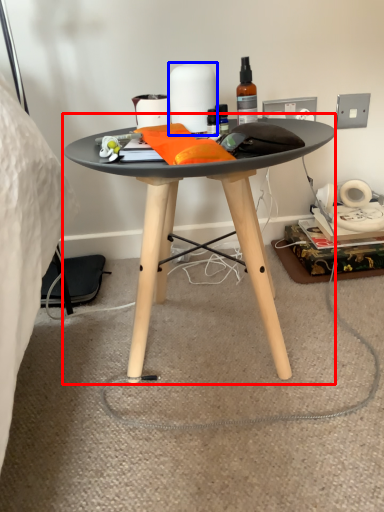
Question: Which object appears farthest to the camera in this image, coffee table (highlighted by a red box) or toilet paper (highlighted by a blue box)?

Choices:
 (A) coffee table
 (B) toilet paper

Answer: (B)